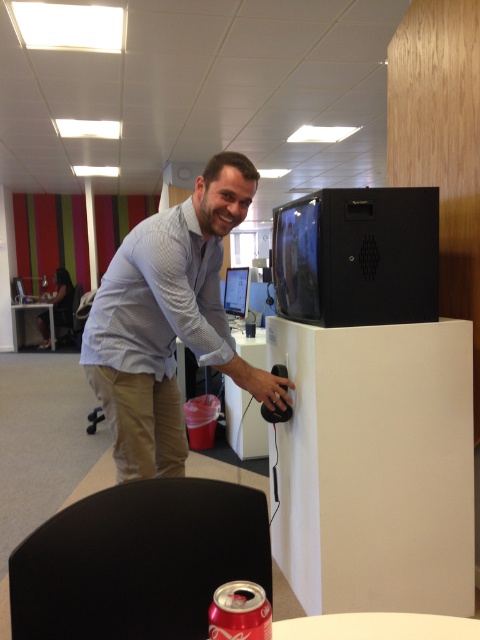
Question: Is red matte soda can at lower center to the left of matte black monitor at center from the viewer's perspective?

Choices:
 (A) yes
 (B) no

Answer: (B)

Question: Is light blue shirt at center bigger than black plastic monitor at upper right?

Choices:
 (A) yes
 (B) no

Answer: (A)

Question: Does light blue shirt at center appear on the right side of red matte soda can at lower center?

Choices:
 (A) no
 (B) yes

Answer: (A)

Question: Which of the following is the farthest from the observer?

Choices:
 (A) matte black monitor at center
 (B) red matte soda can at lower center

Answer: (A)

Question: Which point appears farthest from the camera in this image?

Choices:
 (A) (140, 424)
 (B) (239, 604)

Answer: (A)

Question: Among these points, which one is nearest to the camera?

Choices:
 (A) (224, 296)
 (B) (435, 250)

Answer: (B)